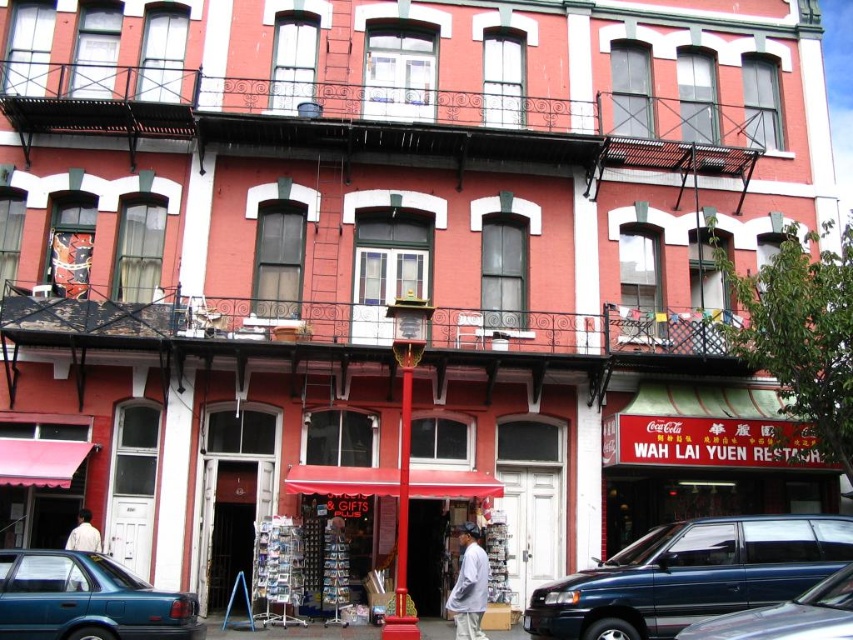
Question: Which is farther from the teal glossy sedan at lower left?

Choices:
 (A) gray cotton shirt at center
 (B) metallic blue van at lower right
 (C) metallic blue minivan at lower right

Answer: (B)

Question: Which of the following is the closest to the observer?

Choices:
 (A) white cotton shirt at lower left
 (B) gray cotton shirt at center

Answer: (B)

Question: Which of the following is the farthest from the observer?

Choices:
 (A) white cotton shirt at lower left
 (B) metallic blue van at lower right

Answer: (A)

Question: Considering the relative positions of teal glossy sedan at lower left and metallic blue van at lower right in the image provided, where is teal glossy sedan at lower left located with respect to metallic blue van at lower right?

Choices:
 (A) right
 (B) left

Answer: (B)

Question: Does teal glossy sedan at lower left lie behind metallic blue van at lower right?

Choices:
 (A) no
 (B) yes

Answer: (B)

Question: Does teal glossy sedan at lower left appear over metallic blue van at lower right?

Choices:
 (A) no
 (B) yes

Answer: (A)